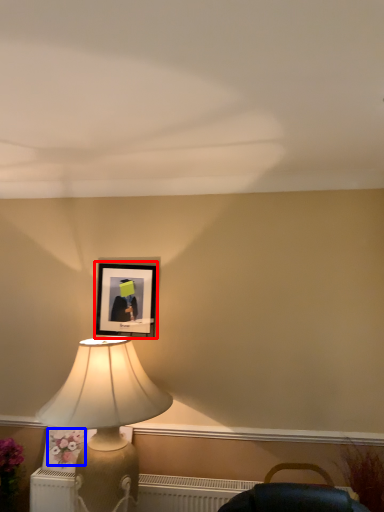
Question: Which object is closer to the camera taking this photo, picture frame (highlighted by a red box) or flower (highlighted by a blue box)?

Choices:
 (A) picture frame
 (B) flower

Answer: (B)